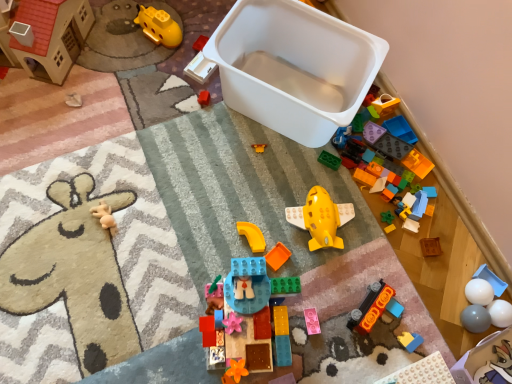
Where is `vacant space behind orange matte block at center, acting as the 6th toy starting from the left`? The width and height of the screenshot is (512, 384). vacant space behind orange matte block at center, acting as the 6th toy starting from the left is located at coordinates (278, 206).